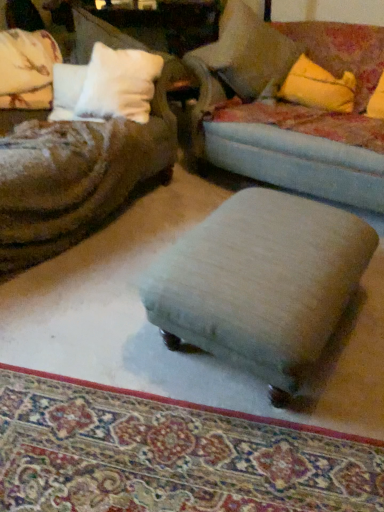
This screenshot has width=384, height=512. I want to click on free space above light beige fabric stool at center (from a real-world perspective), so click(x=264, y=241).